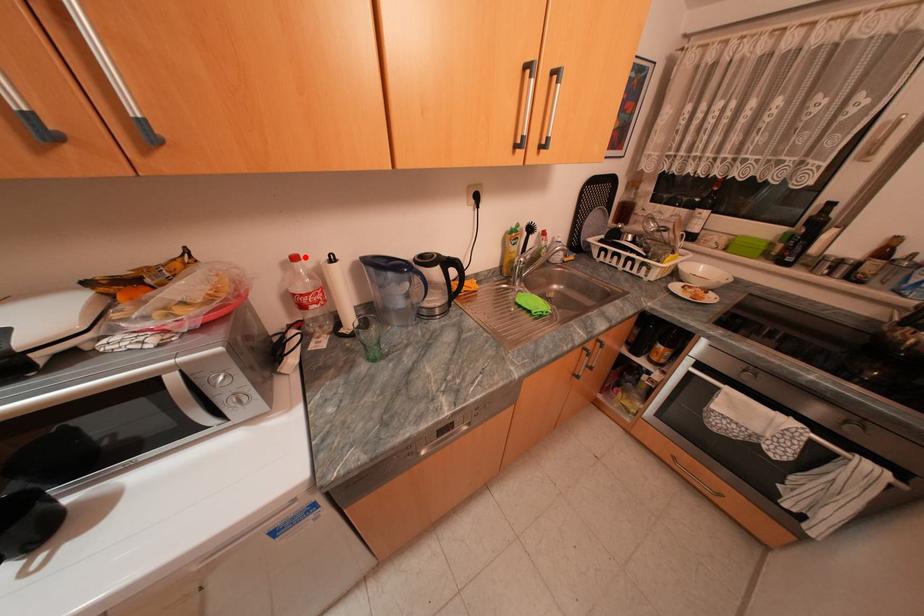
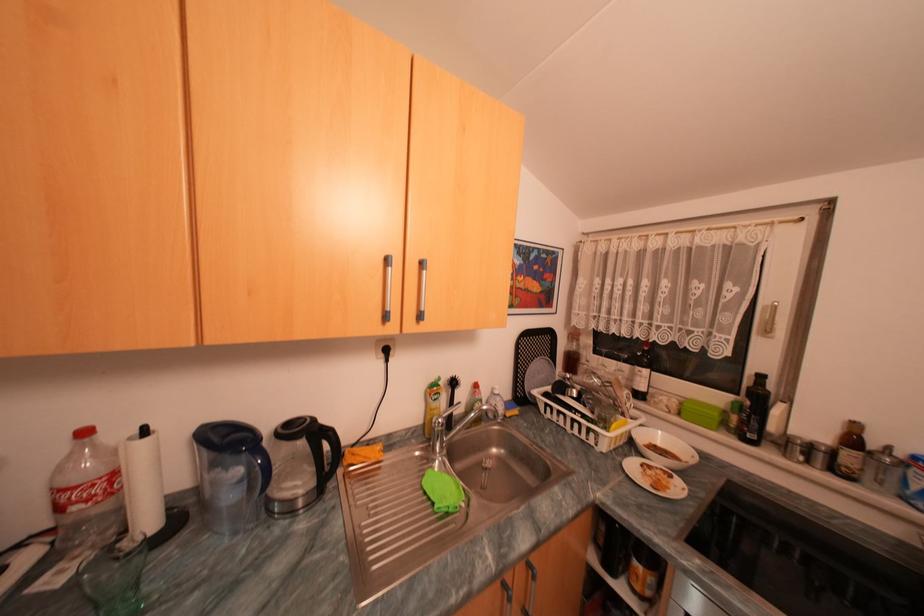
Locate, in the second image, the point that corresponds to the highlighted location in the first image.

(94, 432)